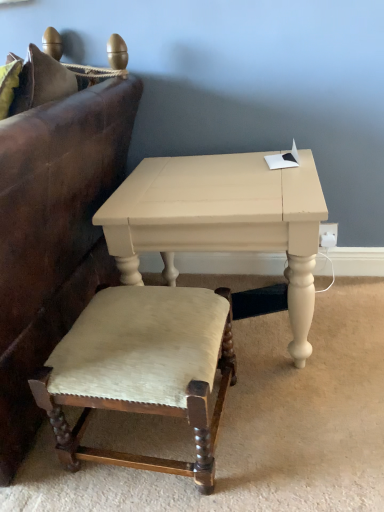
Describe the element at coordinates (142, 370) in the screenshot. I see `velvet upholstered stool at lower left` at that location.

Identify the location of velvet upholstered stool at lower left. (142, 370).

From the image's perspective, is matte white table at center located beneath leather couch at left?

Yes.

Is matte white table at center positioned far away from leather couch at left?

That's not correct — matte white table at center is a little close to leather couch at left.

Is leather couch at left surrounded by matte white table at center?

No.

Is matte white table at center thinner than leather couch at left?

Yes, matte white table at center is thinner than leather couch at left.

From the image's perspective, is leather couch at left on velvet upholstered stool at lower left?

Yes, from the image's perspective, leather couch at left is above velvet upholstered stool at lower left.

Looking at the image, does leather couch at left seem bigger or smaller compared to velvet upholstered stool at lower left?

Clearly, leather couch at left is larger in size than velvet upholstered stool at lower left.

How different are the orientations of leather couch at left and velvet upholstered stool at lower left in degrees?

0.149 degrees.

Considering the sizes of velvet upholstered stool at lower left and matte white table at center in the image, is velvet upholstered stool at lower left wider or thinner than matte white table at center?

velvet upholstered stool at lower left is thinner than matte white table at center.

Could matte white table at center be considered to be inside velvet upholstered stool at lower left?

No.

Would you consider velvet upholstered stool at lower left to be distant from matte white table at center?

velvet upholstered stool at lower left is near matte white table at center, not far away.

Is velvet upholstered stool at lower left behind matte white table at center?

No.

Which is behind, point (187, 306) or point (4, 292)?

Point (187, 306)

Can you confirm if velvet upholstered stool at lower left is bigger than leather couch at left?

Actually, velvet upholstered stool at lower left might be smaller than leather couch at left.

From the image's perspective, is velvet upholstered stool at lower left above or below leather couch at left?

Based on their image positions, velvet upholstered stool at lower left is located beneath leather couch at left.

Considering the sizes of objects leather couch at left and matte white table at center in the image provided, who is wider, leather couch at left or matte white table at center?

Wider between the two is leather couch at left.

Does leather couch at left have a larger size compared to matte white table at center?

A: Yes.

How much distance is there between leather couch at left and matte white table at center?

A distance of 11.24 inches exists between leather couch at left and matte white table at center.

Which is behind, leather couch at left or matte white table at center?

matte white table at center is more distant.

From the image's perspective, is matte white table at center positioned above or below velvet upholstered stool at lower left?

matte white table at center is situated higher than velvet upholstered stool at lower left in the image.

From a real-world perspective, between matte white table at center and velvet upholstered stool at lower left, who is vertically higher?

matte white table at center is physically above.

Considering the relative sizes of matte white table at center and velvet upholstered stool at lower left in the image provided, is matte white table at center shorter than velvet upholstered stool at lower left?

Incorrect, the height of matte white table at center does not fall short of that of velvet upholstered stool at lower left.

Which is closer, (142, 231) or (127, 305)?

The point (127, 305) is closer.

This screenshot has width=384, height=512. What are the coordinates of `table below the leather couch at left (from a real-world perspective)` in the screenshot? It's located at (221, 220).

Where is `studio couch that appears above the velvet upholstered stool at lower left (from a real-world perspective)`? studio couch that appears above the velvet upholstered stool at lower left (from a real-world perspective) is located at coordinates (54, 219).

From the picture: From the image, which object appears to be farther from matte white table at center, velvet upholstered stool at lower left or leather couch at left?

The object further to matte white table at center is velvet upholstered stool at lower left.

Consider the image. From the image, which object appears to be nearer to matte white table at center, leather couch at left or velvet upholstered stool at lower left?

leather couch at left is closer to matte white table at center.

Based on their spatial positions, is leather couch at left or matte white table at center further from velvet upholstered stool at lower left?

Based on the image, leather couch at left appears to be further to velvet upholstered stool at lower left.

From the image, which object appears to be farther from velvet upholstered stool at lower left, matte white table at center or leather couch at left?

leather couch at left lies further to velvet upholstered stool at lower left than the other object.

Which object lies further to the anchor point leather couch at left, matte white table at center or velvet upholstered stool at lower left?

velvet upholstered stool at lower left lies further to leather couch at left than the other object.

Looking at the image, which one is located further to leather couch at left, velvet upholstered stool at lower left or matte white table at center?

velvet upholstered stool at lower left lies further to leather couch at left than the other object.

Image resolution: width=384 pixels, height=512 pixels. In order to click on chair situated between leather couch at left and matte white table at center from left to right in this screenshot , I will do `click(142, 370)`.